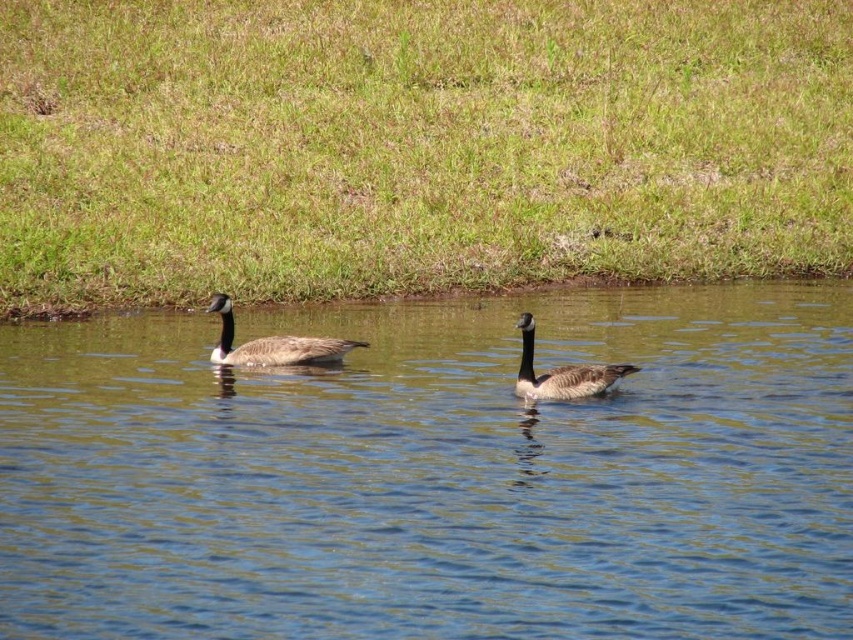
Based on the photo, who is higher up, green grass at center or dark gray feathers at center?

green grass at center is higher up.

Is green grass at center taller than dark gray feathers at center?

Correct, green grass at center is much taller as dark gray feathers at center.

What do you see at coordinates (415, 145) in the screenshot? I see `green grass at center` at bounding box center [415, 145].

Identify the location of green grass at center. (415, 145).

Does clear blue water at center lie behind green grass at center?

That is False.

The height and width of the screenshot is (640, 853). In order to click on clear blue water at center in this screenshot , I will do `click(436, 472)`.

Where is `clear blue water at center`? This screenshot has height=640, width=853. clear blue water at center is located at coordinates (436, 472).

Is clear blue water at center wider than dark gray feathers at center?

Indeed, clear blue water at center has a greater width compared to dark gray feathers at center.

Can you confirm if clear blue water at center is taller than dark gray feathers at center?

Correct, clear blue water at center is much taller as dark gray feathers at center.

Describe the element at coordinates (436, 472) in the screenshot. The height and width of the screenshot is (640, 853). I see `clear blue water at center` at that location.

You are a GUI agent. You are given a task and a screenshot of the screen. Output one action in this format:
    pyautogui.click(x=<x>, y=<y>)
    Task: Click on the clear blue water at center
    
    Given the screenshot: What is the action you would take?
    pyautogui.click(x=436, y=472)